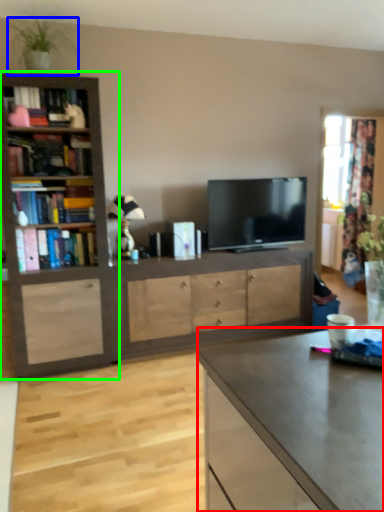
Question: Estimate the real-world distances between objects in this image. Which object is farther from desk (highlighted by a red box), houseplant (highlighted by a blue box) or bookcase (highlighted by a green box)?

Choices:
 (A) houseplant
 (B) bookcase

Answer: (A)